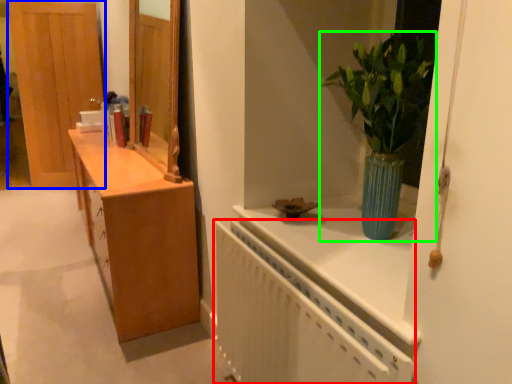
Question: Which object is positioned farthest from radiator (highlighted by a red box)? Select from door (highlighted by a blue box) and houseplant (highlighted by a green box).

Choices:
 (A) door
 (B) houseplant

Answer: (A)